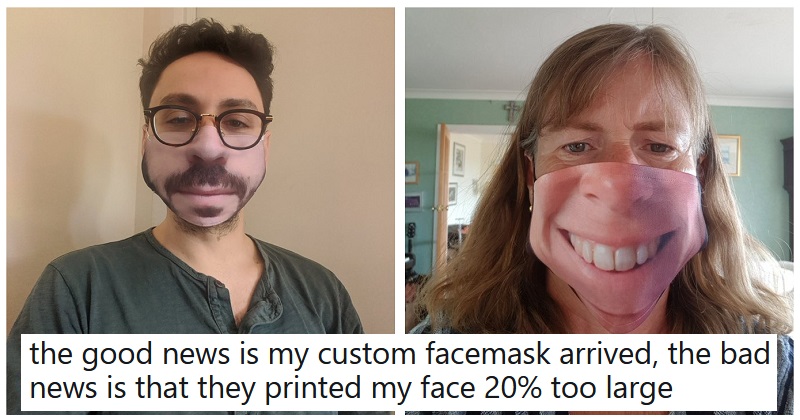
Find the location of a particular element. door is located at coordinates (442, 216).